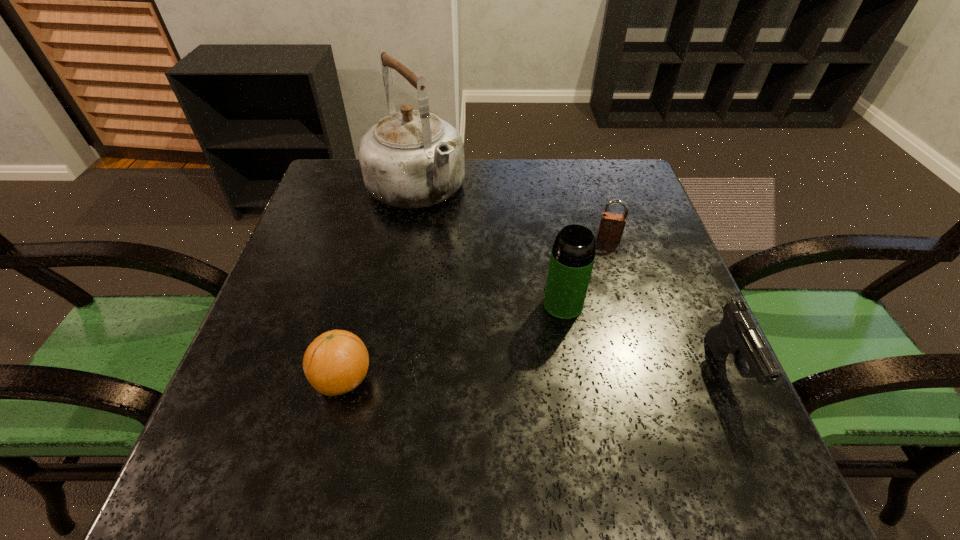
Where is `free space located on the front-facing side of the second farthest object`? free space located on the front-facing side of the second farthest object is located at coordinates (605, 259).

The image size is (960, 540). Find the location of `vacant region located 0.130m on the front-facing side of the second farthest object`. vacant region located 0.130m on the front-facing side of the second farthest object is located at coordinates (603, 280).

This screenshot has height=540, width=960. I want to click on blank space located from the spout of the thermos bottle, so click(495, 386).

At what (x,y) coordinates should I click in order to perform the action: click on free space located from the spout of the thermos bottle. Please return your answer as a coordinate pair (x, y). This screenshot has height=540, width=960. Looking at the image, I should click on (479, 407).

What are the coordinates of `free space located from the spout of the thermos bottle` in the screenshot? It's located at (492, 390).

The height and width of the screenshot is (540, 960). What are the coordinates of `free point located at the spout of the farthest object` in the screenshot? It's located at (504, 292).

The height and width of the screenshot is (540, 960). In order to click on vacant region located 0.390m at the spout of the farthest object in this screenshot , I will do click(x=532, y=322).

The height and width of the screenshot is (540, 960). What are the coordinates of `vacant space located 0.110m at the spout of the farthest object` in the screenshot? It's located at (461, 244).

The width and height of the screenshot is (960, 540). I want to click on object that is at the far edge, so click(410, 159).

Locate an element on the screen. Image resolution: width=960 pixels, height=540 pixels. orange located in the near edge section of the desktop is located at coordinates (336, 362).